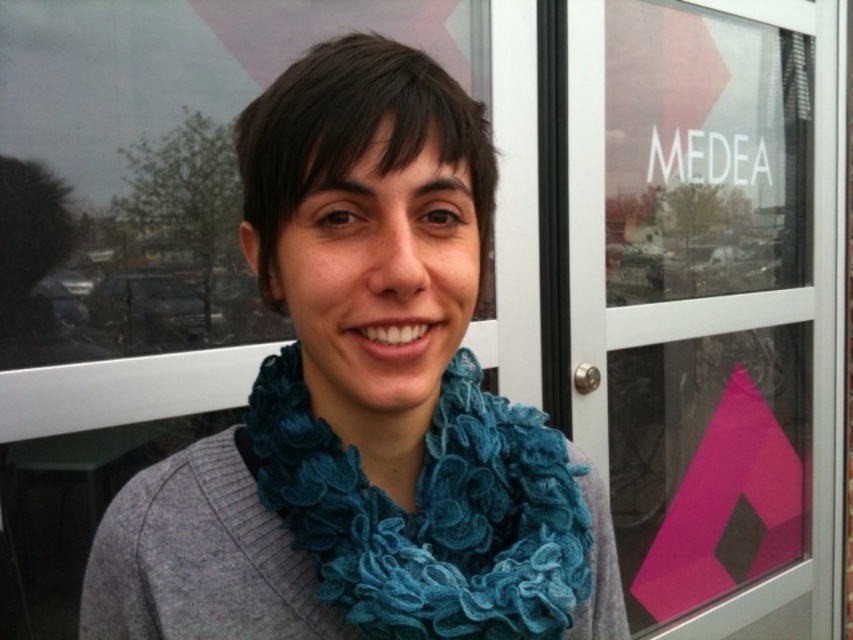
Question: Considering the real-world distances, which object is closest to the teal knitted scarf at center?

Choices:
 (A) blue knitted scarf at center
 (B) pink matte screen door at upper center

Answer: (A)

Question: Is pink matte screen door at upper center smaller than teal knitted scarf at center?

Choices:
 (A) no
 (B) yes

Answer: (A)

Question: Which of the following is the closest to the observer?

Choices:
 (A) (633, 497)
 (B) (461, 353)

Answer: (B)

Question: Is blue knitted scarf at center bigger than teal knitted scarf at center?

Choices:
 (A) yes
 (B) no

Answer: (A)

Question: Is pink matte screen door at upper center bigger than teal knitted scarf at center?

Choices:
 (A) yes
 (B) no

Answer: (A)

Question: Which point is farther to the camera?

Choices:
 (A) teal knitted scarf at center
 (B) blue knitted scarf at center
 (C) pink matte screen door at upper center

Answer: (C)